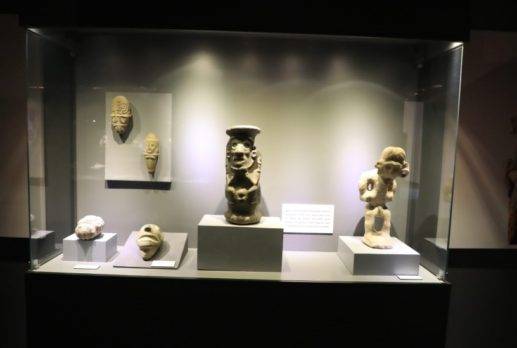
Where is `display stands`? display stands is located at coordinates (228, 301), (12, 248), (486, 256), (370, 265), (243, 256), (172, 252), (84, 250), (126, 158).